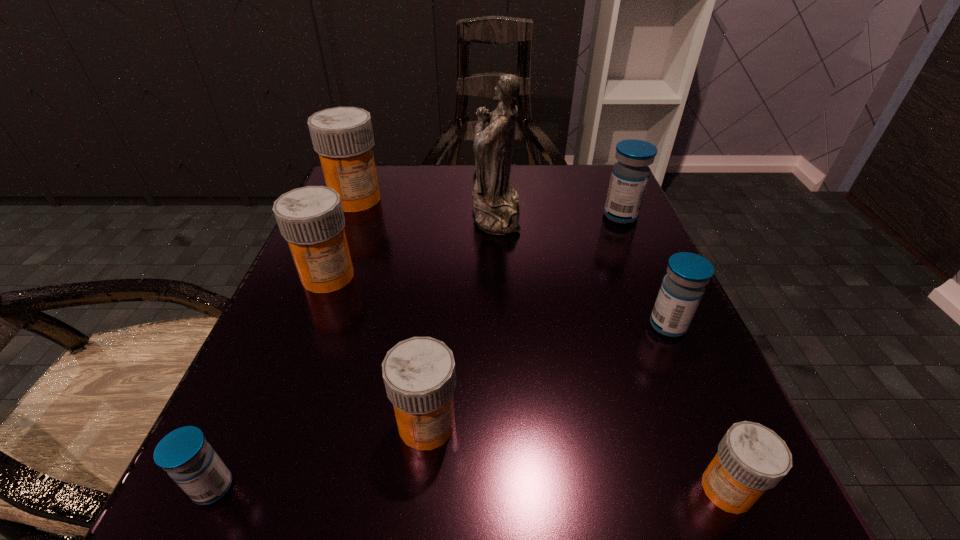
Where is `object that is at the far right corner`? The width and height of the screenshot is (960, 540). object that is at the far right corner is located at coordinates (630, 175).

The image size is (960, 540). I want to click on object located in the near right corner section of the desktop, so click(x=751, y=458).

In order to click on free space at the far edge of the desktop in this screenshot , I will do `click(418, 214)`.

Find the location of a particular element. Image resolution: width=960 pixels, height=540 pixels. free location at the near edge is located at coordinates (573, 461).

In the image, there is a desktop. What are the coordinates of `vacant area at the left edge` in the screenshot? It's located at (396, 227).

At what (x,y) coordinates should I click in order to perform the action: click on vacant space at the right edge of the desktop. Please return your answer as a coordinate pair (x, y). Looking at the image, I should click on (621, 343).

In the image, there is a desktop. At what (x,y) coordinates should I click in order to perform the action: click on vacant space at the far left corner. Please return your answer as a coordinate pair (x, y). This screenshot has width=960, height=540. Looking at the image, I should click on (388, 218).

Image resolution: width=960 pixels, height=540 pixels. I want to click on free space at the near right corner of the desktop, so click(756, 506).

I want to click on vacant area between the tallest object and the tallest medicine, so click(426, 206).

You are a GUI agent. You are given a task and a screenshot of the screen. Output one action in this format:
    pyautogui.click(x=<x>, y=<y>)
    Task: Click on the free space between the second tallest object and the fourth medicine from right to left
    The image size is (960, 540).
    Given the screenshot: What is the action you would take?
    pyautogui.click(x=392, y=312)